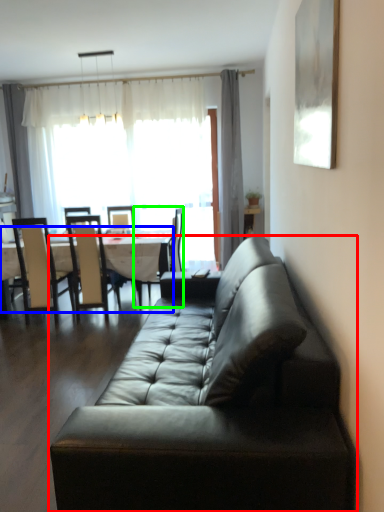
Question: Considering the real-world distances, which object is closest to studio couch (highlighted by a red box)? kitchen & dining room table (highlighted by a blue box) or chair (highlighted by a green box).

Choices:
 (A) kitchen & dining room table
 (B) chair

Answer: (A)